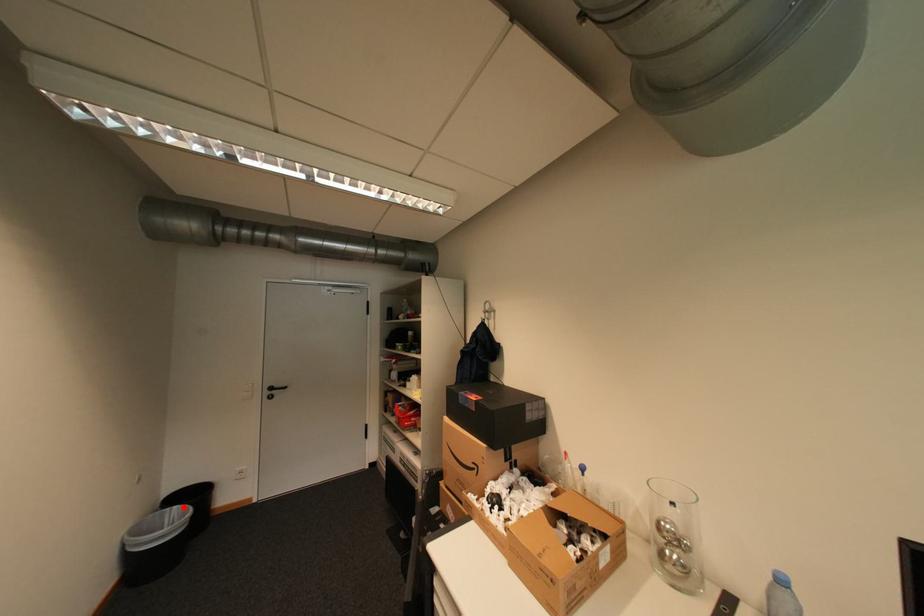
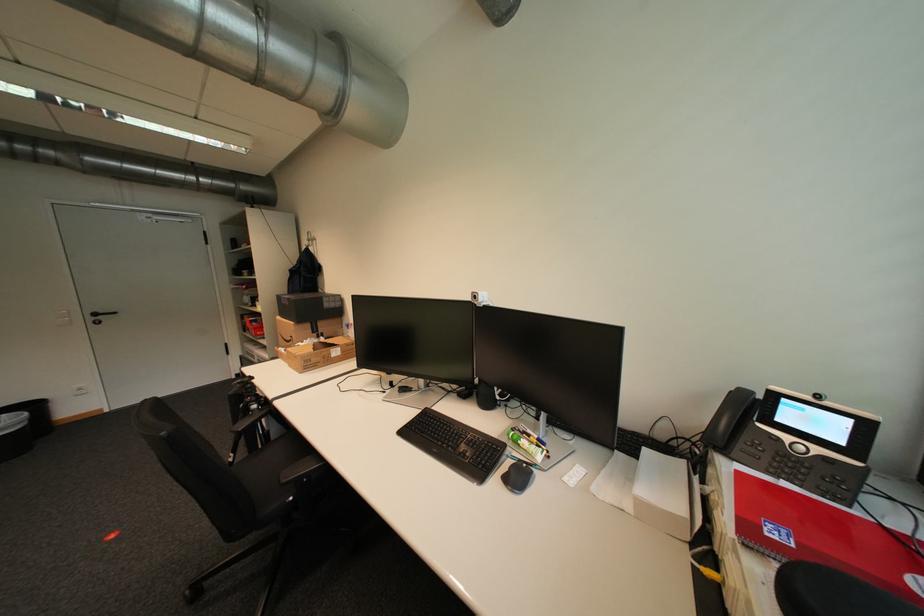
The point at the highlighted location is marked in the first image. Where is the corresponding point in the second image?

(11, 416)